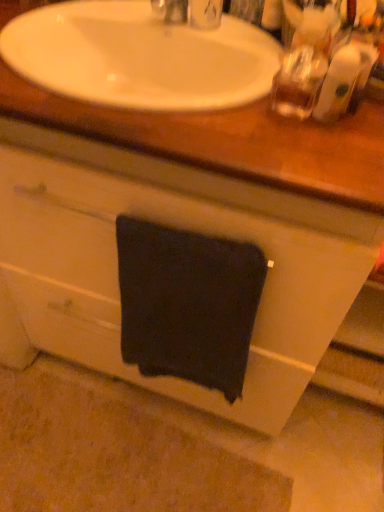
Describe the element at coordinates (187, 303) in the screenshot. I see `dark fabric towel at center` at that location.

In order to face dark fabric towel at center, should I rotate leftwards or rightwards?

To face it directly, rotate left by 1.167 degrees.

You are a GUI agent. You are given a task and a screenshot of the screen. Output one action in this format:
    pyautogui.click(x=<x>, y=<y>)
    Task: Click on the dark fabric towel at center
    The height and width of the screenshot is (512, 384).
    Given the screenshot: What is the action you would take?
    pyautogui.click(x=187, y=303)

Measure the distance between dark fabric towel at center and camera.

dark fabric towel at center and camera are 26.32 inches apart.

Measure the distance between white glossy sink at upper center and camera.

white glossy sink at upper center is 20.79 inches away from camera.

Describe the element at coordinates (230, 140) in the screenshot. I see `white glossy sink at upper center` at that location.

Image resolution: width=384 pixels, height=512 pixels. I want to click on white glossy sink at upper center, so click(230, 140).

Locate an element on the screen. This screenshot has height=512, width=384. dark fabric towel at center is located at coordinates (187, 303).

Which is more to the left, white glossy sink at upper center or dark fabric towel at center?

From the viewer's perspective, white glossy sink at upper center appears more on the left side.

Looking at this image, relative to dark fabric towel at center, is white glossy sink at upper center in front or behind?

In the image, white glossy sink at upper center appears in front of dark fabric towel at center.

Considering the positions of points (27, 93) and (124, 304), is point (27, 93) closer to camera compared to point (124, 304)?

Yes.

From the image's perspective, is white glossy sink at upper center under dark fabric towel at center?

No, from the image's perspective, white glossy sink at upper center is not below dark fabric towel at center.

From a real-world perspective, is white glossy sink at upper center positioned above or below dark fabric towel at center?

white glossy sink at upper center is situated higher than dark fabric towel at center in the real world.

Considering the sizes of objects white glossy sink at upper center and dark fabric towel at center in the image provided, who is wider, white glossy sink at upper center or dark fabric towel at center?

white glossy sink at upper center.

Considering the relative sizes of white glossy sink at upper center and dark fabric towel at center in the image provided, is white glossy sink at upper center shorter than dark fabric towel at center?

Yes, white glossy sink at upper center is shorter than dark fabric towel at center.

Between white glossy sink at upper center and dark fabric towel at center, which one has larger size?

Bigger between the two is white glossy sink at upper center.

Would you say dark fabric towel at center is part of white glossy sink at upper center's contents?

No, dark fabric towel at center is not a part of white glossy sink at upper center.

Is white glossy sink at upper center far away from dark fabric towel at center?

No, there isn't a large distance between white glossy sink at upper center and dark fabric towel at center.

Is white glossy sink at upper center looking in the opposite direction of dark fabric towel at center?

white glossy sink at upper center is not turned away from dark fabric towel at center.

How far apart are white glossy sink at upper center and dark fabric towel at center?

The distance of white glossy sink at upper center from dark fabric towel at center is 10.68 inches.

The image size is (384, 512). I want to click on towel/napkin behind the white glossy sink at upper center, so pyautogui.click(x=187, y=303).

Is dark fabric towel at center to the left or to the right of white glossy sink at upper center in the image?

In the image, dark fabric towel at center appears on the right side of white glossy sink at upper center.

Considering the relative positions of dark fabric towel at center and white glossy sink at upper center in the image provided, is dark fabric towel at center behind white glossy sink at upper center?

Yes.

Considering the positions of points (218, 258) and (193, 114), is point (218, 258) closer to camera compared to point (193, 114)?

That is False.

From the image's perspective, which is below, dark fabric towel at center or white glossy sink at upper center?

From the image's view, dark fabric towel at center is below.

From a real-world perspective, which object rests below the other?

In real-world perspective, dark fabric towel at center is lower.

Is dark fabric towel at center wider than white glossy sink at upper center?

No.

Is dark fabric towel at center taller than white glossy sink at upper center?

Yes.

Does dark fabric towel at center have a larger size compared to white glossy sink at upper center?

Actually, dark fabric towel at center might be smaller than white glossy sink at upper center.

Is dark fabric towel at center outside of white glossy sink at upper center?

Absolutely, dark fabric towel at center is external to white glossy sink at upper center.

Is dark fabric towel at center next to white glossy sink at upper center and touching it?

dark fabric towel at center and white glossy sink at upper center are not in contact.

Consider the image. Is white glossy sink at upper center at the back of dark fabric towel at center?

That's not correct — dark fabric towel at center is not looking away from white glossy sink at upper center.

How different are the orientations of dark fabric towel at center and white glossy sink at upper center in degrees?

There is a 0.000594-degree angle between the facing directions of dark fabric towel at center and white glossy sink at upper center.

In the scene shown: How much distance is there between dark fabric towel at center and white glossy sink at upper center?

They are 10.68 inches apart.

Where is `towel/napkin below the white glossy sink at upper center (from the image's perspective)`? Image resolution: width=384 pixels, height=512 pixels. towel/napkin below the white glossy sink at upper center (from the image's perspective) is located at coordinates (187, 303).

Identify the location of counter top above the dark fabric towel at center (from a real-world perspective). (230, 140).

The width and height of the screenshot is (384, 512). What are the coordinates of `counter top that appears on the left of dark fabric towel at center` in the screenshot? It's located at (230, 140).